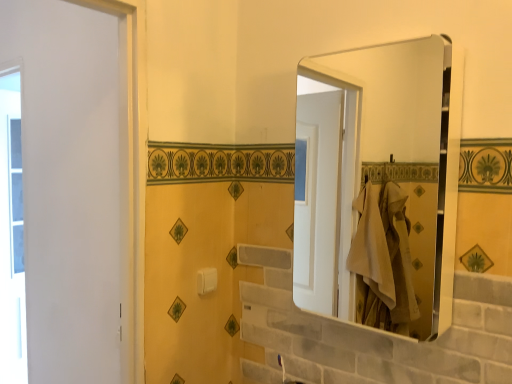
Question: From a real-world perspective, relative to white plastic towel bar at center, is transparent glass window at left vertically above or below?

Choices:
 (A) below
 (B) above

Answer: (A)

Question: Considering their positions, is transparent glass window at left located in front of or behind white plastic towel bar at center?

Choices:
 (A) behind
 (B) front

Answer: (A)

Question: Which object is positioned farthest from the transparent glass window at left?

Choices:
 (A) white plastic towel bar at center
 (B) metallic silver mirror at upper right

Answer: (B)

Question: Which object is positioned farthest from the white plastic towel bar at center?

Choices:
 (A) metallic silver mirror at upper right
 (B) transparent glass window at left

Answer: (B)